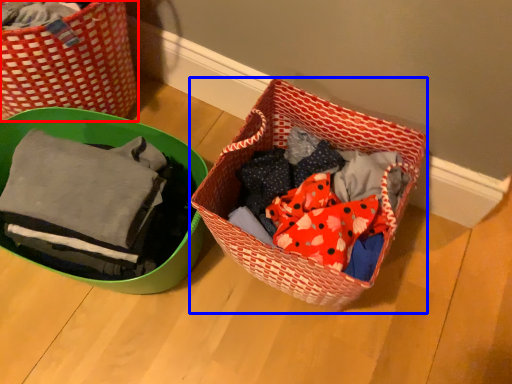
Question: Which object appears closest to the camera in this image, picnic basket (highlighted by a red box) or picnic basket (highlighted by a blue box)?

Choices:
 (A) picnic basket
 (B) picnic basket

Answer: (B)